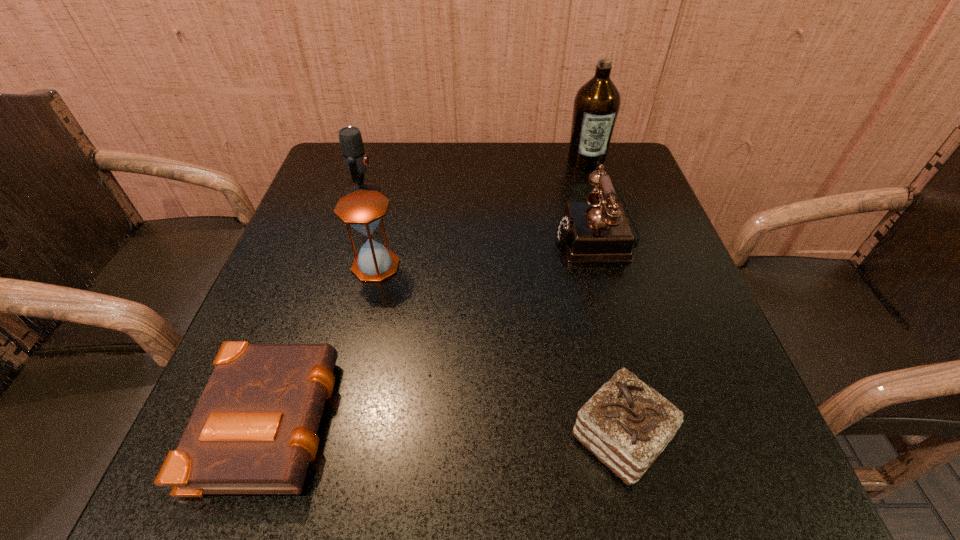
I want to click on hourglass that is at the left edge, so click(363, 209).

Image resolution: width=960 pixels, height=540 pixels. In order to click on Bible that is at the left edge in this screenshot , I will do `click(254, 429)`.

I want to click on olive oil that is at the right edge, so click(596, 106).

The width and height of the screenshot is (960, 540). I want to click on telephone positioned at the right edge, so click(x=597, y=231).

Locate an element on the screen. The width and height of the screenshot is (960, 540). chocolate cake that is at the right edge is located at coordinates (626, 424).

At what (x,y) coordinates should I click in order to perform the action: click on object that is at the far left corner. Please return your answer as a coordinate pair (x, y). The width and height of the screenshot is (960, 540). Looking at the image, I should click on (355, 159).

I want to click on object situated at the near left corner, so click(254, 429).

Find the location of a particular element. object that is at the far right corner is located at coordinates (596, 106).

Where is `object at the near right corner`? The width and height of the screenshot is (960, 540). object at the near right corner is located at coordinates (626, 424).

Locate an element on the screen. vacant area at the far edge of the desktop is located at coordinates (482, 144).